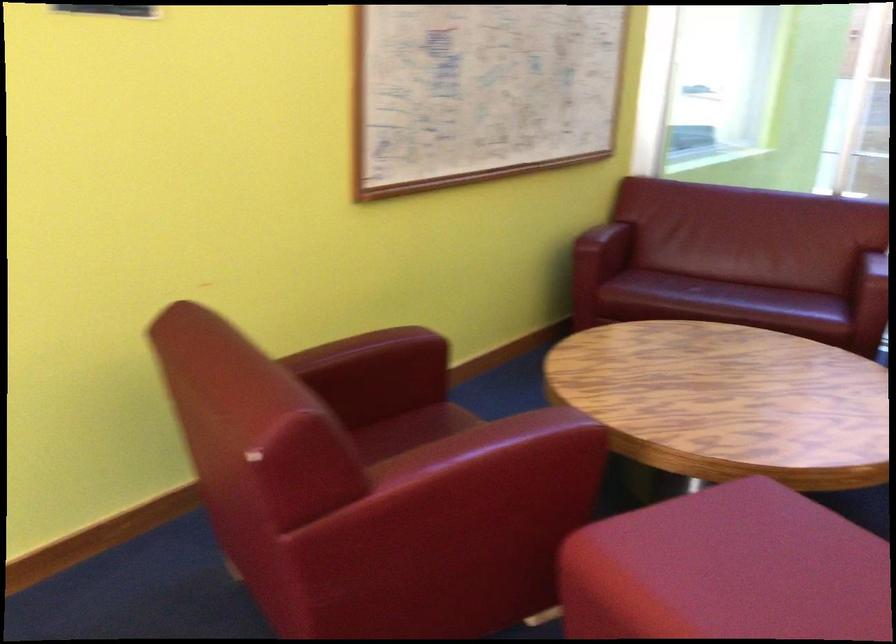
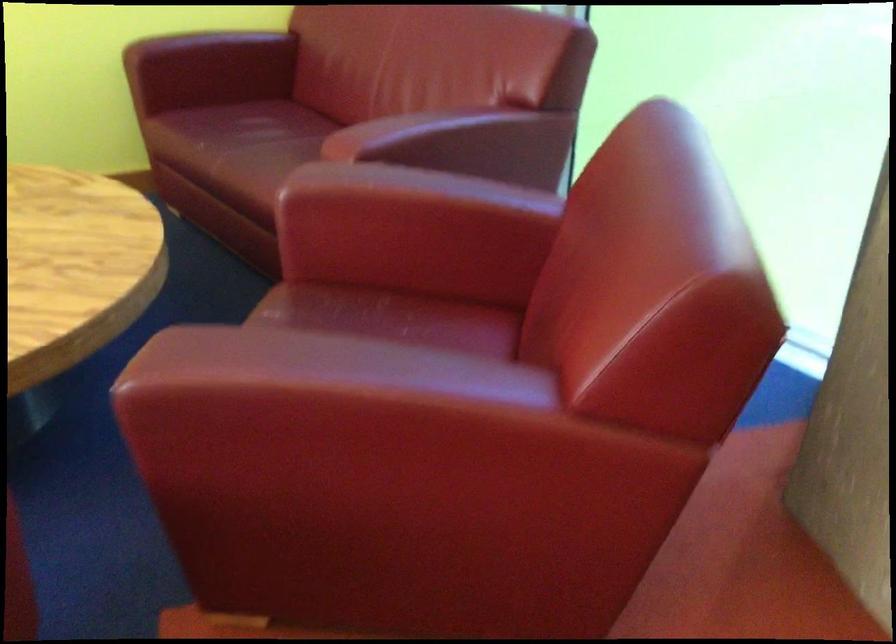
Looking at this image, which direction would the cameraman need to move to produce the second image?

The cameraman walked toward right, forward.